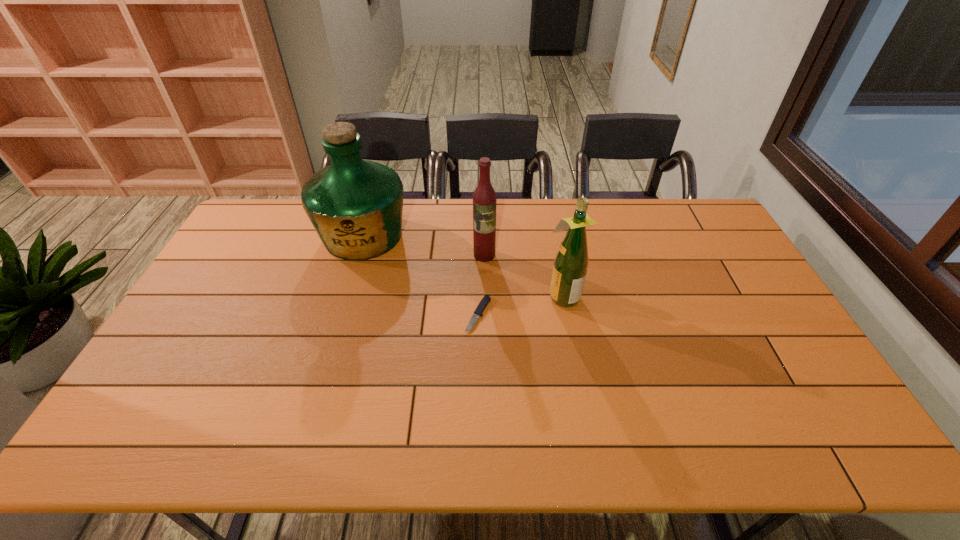
The height and width of the screenshot is (540, 960). I want to click on vacant space situated on the back of the steak knife, so click(478, 266).

Find the location of a particular element. Image resolution: width=960 pixels, height=540 pixels. object at the far edge is located at coordinates (355, 205).

In the image, there is a desktop. At what (x,y) coordinates should I click in order to perform the action: click on vacant area at the far edge. Please return your answer as a coordinate pair (x, y). Looking at the image, I should click on (434, 234).

This screenshot has width=960, height=540. What are the coordinates of `vacant space at the near edge of the desktop` in the screenshot? It's located at (183, 450).

Identify the location of free space at the left edge. This screenshot has width=960, height=540. (213, 341).

The height and width of the screenshot is (540, 960). In the image, there is a desktop. What are the coordinates of `blank space at the right edge` in the screenshot? It's located at (739, 292).

In the image, there is a desktop. Identify the location of free space at the far left corner. The width and height of the screenshot is (960, 540). (242, 222).

Where is `free space at the far right corner`? This screenshot has height=540, width=960. free space at the far right corner is located at coordinates (685, 207).

Find the location of a particular element. The height and width of the screenshot is (540, 960). vacant area that lies between the leftmost object and the rightmost liquor is located at coordinates (463, 266).

Find the location of a particular element. The image size is (960, 540). empty space that is in between the rightmost object and the leftmost object is located at coordinates (463, 266).